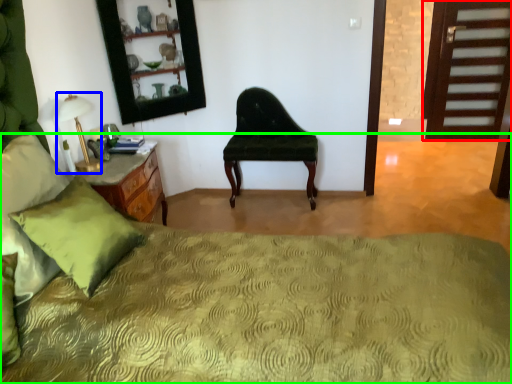
Question: Considering the real-world distances, which object is closest to door (highlighted by a red box)? table lamp (highlighted by a blue box) or bed (highlighted by a green box).

Choices:
 (A) table lamp
 (B) bed

Answer: (B)